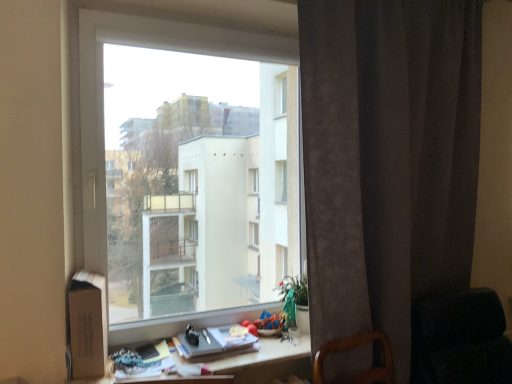
At what (x,y) coordinates should I click in order to perform the action: click on free space to the right of matte gray book at lower center. Please return your answer as a coordinate pair (x, y). The width and height of the screenshot is (512, 384). Looking at the image, I should click on (273, 352).